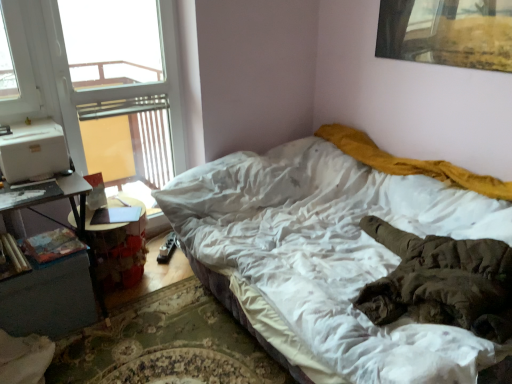
Locate an element on the screen. free point to the right of wooden cylindrical at left, which is the second book from right to left is located at coordinates (48, 251).